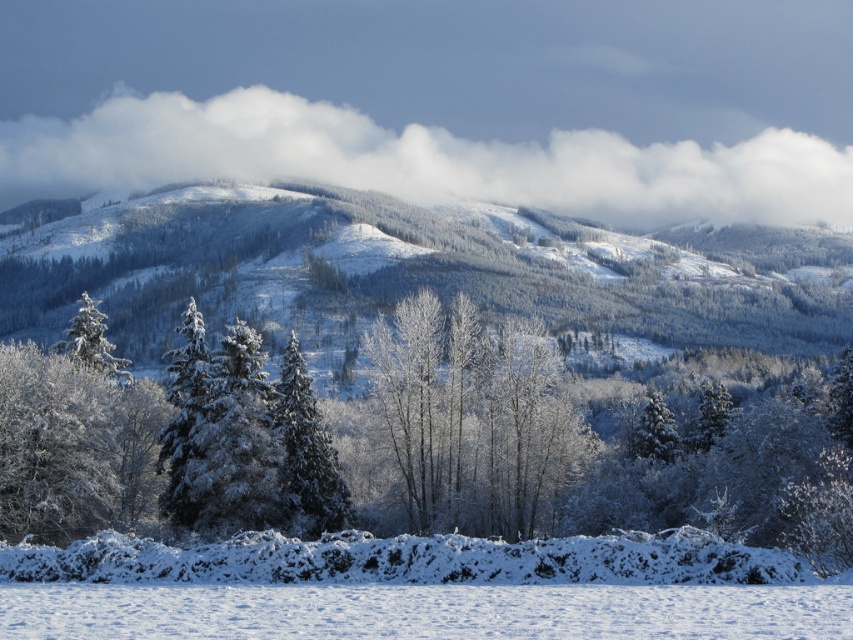
Question: Can you confirm if snow-covered mountain at upper center is positioned to the left of white fluffy snow at lower center?

Choices:
 (A) no
 (B) yes

Answer: (A)

Question: Observing the image, what is the correct spatial positioning of snow-covered mountain at upper center in reference to green matte evergreen tree at center?

Choices:
 (A) right
 (B) left

Answer: (A)

Question: Which object is positioned closest to the white fluffy snow at lower center?

Choices:
 (A) snow-covered mountain at upper center
 (B) green matte evergreen tree at center
 (C) white fluffy cloud at upper center

Answer: (B)

Question: Is snow-covered mountain at upper center further to the viewer compared to green matte evergreen tree at center?

Choices:
 (A) yes
 (B) no

Answer: (A)

Question: Which object appears closest to the camera in this image?

Choices:
 (A) green matte evergreen tree at center
 (B) white fluffy snow at lower center

Answer: (B)

Question: Which of these objects is positioned farthest from the white fluffy cloud at upper center?

Choices:
 (A) white fluffy snow at lower center
 (B) snow-covered mountain at upper center
 (C) green matte evergreen tree at center

Answer: (A)